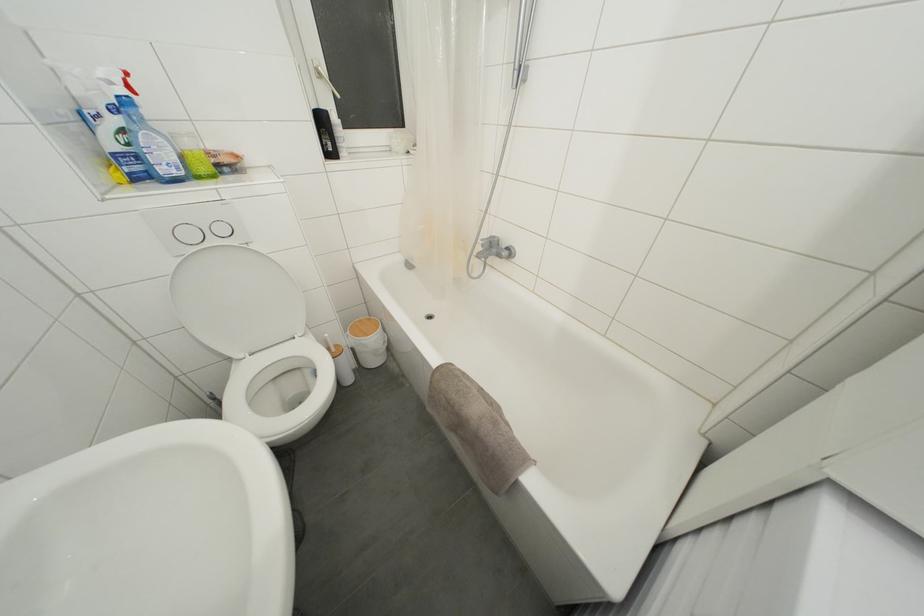
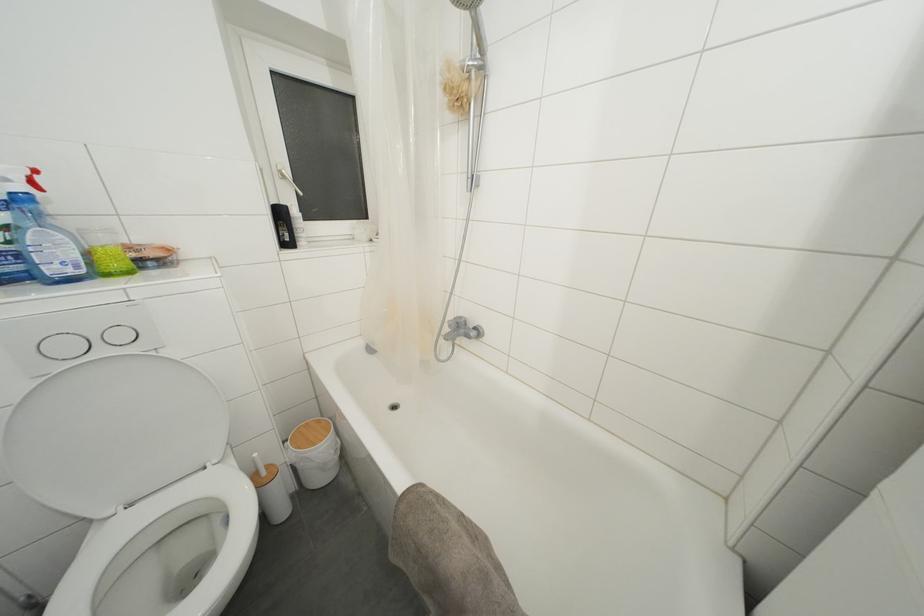
Locate, in the second image, the point that corresponds to point 193,148 in the first image.

(108, 245)